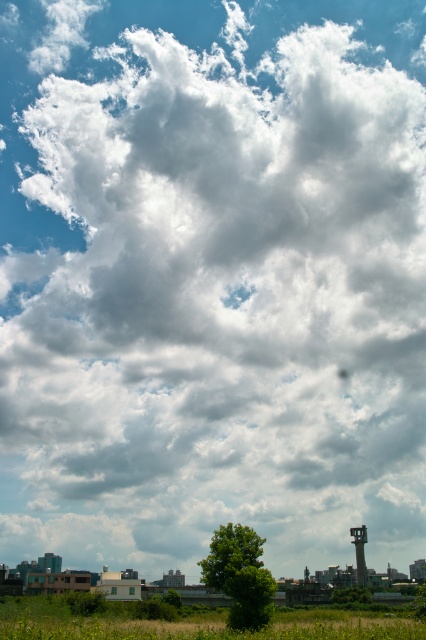
Question: Is green grass at lower center bigger than green leafy tree at center?

Choices:
 (A) yes
 (B) no

Answer: (A)

Question: Can you confirm if green leafy tree at center is smaller than green matte tree at lower center?

Choices:
 (A) no
 (B) yes

Answer: (B)

Question: Estimate the real-world distances between objects in this image. Which object is closer to the green leafy tree at center?

Choices:
 (A) green matte tree at lower center
 (B) green grass at lower center

Answer: (B)

Question: Which object is positioned farthest from the green leafy tree at center?

Choices:
 (A) green matte tree at lower center
 (B) green grass at lower center

Answer: (A)

Question: Can you confirm if green grass at lower center is bigger than green matte tree at lower center?

Choices:
 (A) yes
 (B) no

Answer: (A)

Question: Which of the following is the farthest from the observer?

Choices:
 (A) (268, 572)
 (B) (325, 636)
 (C) (345, 592)

Answer: (C)